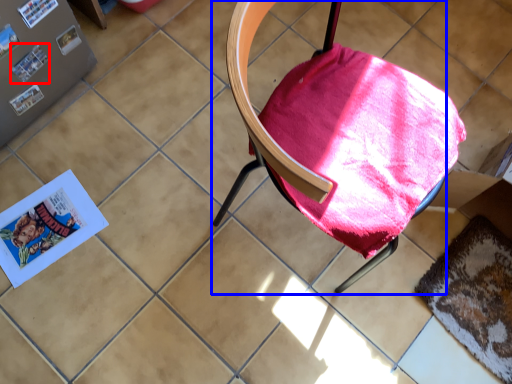
Question: Which object appears farthest to the camera in this image, paperback book (highlighted by a red box) or chair (highlighted by a blue box)?

Choices:
 (A) paperback book
 (B) chair

Answer: (A)